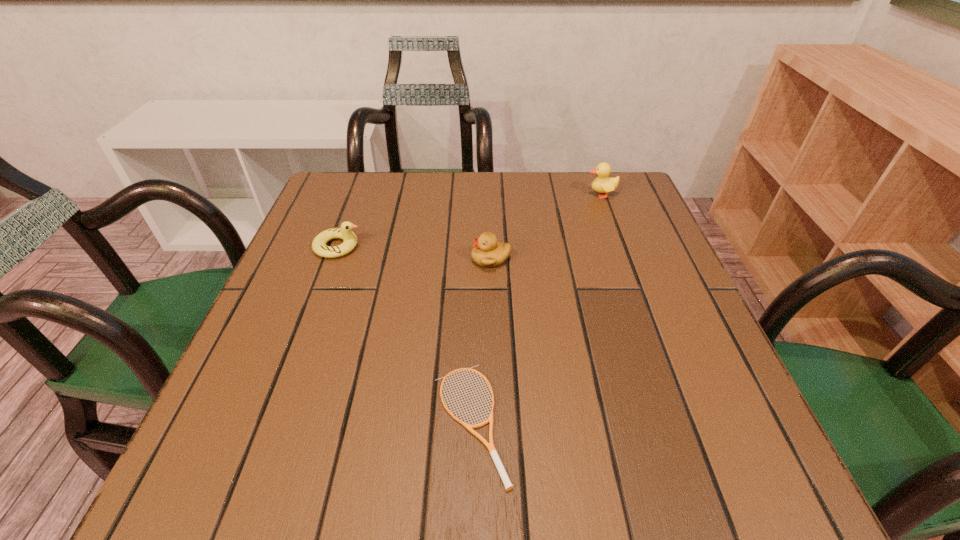
This screenshot has width=960, height=540. In order to click on free location that satisfies the following two spatial constraints: 1. on the face of the leftmost object; 2. on the right side of the shortest object in this screenshot , I will do `click(273, 422)`.

This screenshot has height=540, width=960. I want to click on free space that satisfies the following two spatial constraints: 1. on the front-facing side of the tallest object; 2. on the front side of the shortest object, so click(684, 422).